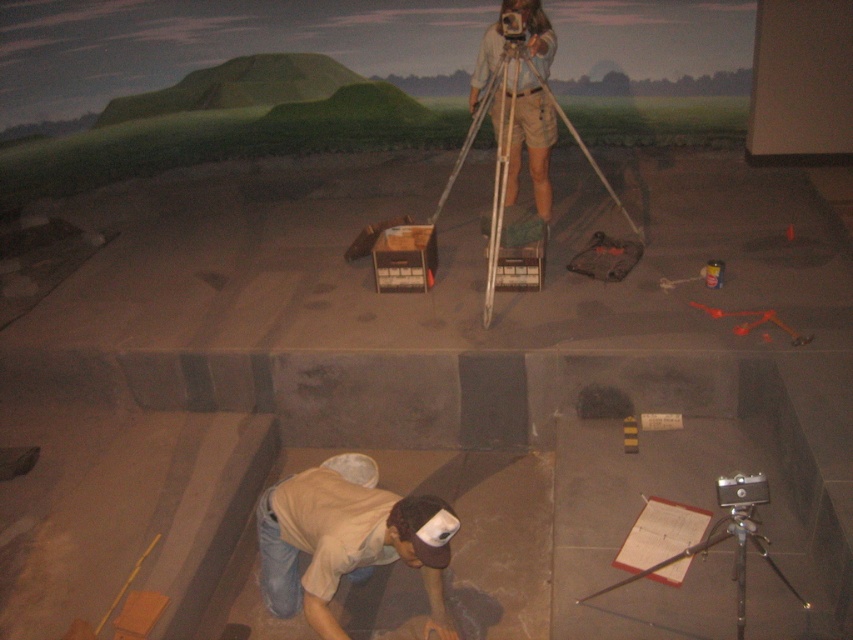
Which is more to the right, brown cotton shirt at lower center or silver metallic tripod at lower right?

Positioned to the right is silver metallic tripod at lower right.

Can you confirm if brown cotton shirt at lower center is positioned above silver metallic tripod at lower right?

Incorrect, brown cotton shirt at lower center is not positioned above silver metallic tripod at lower right.

Locate an element on the screen. brown cotton shirt at lower center is located at coordinates (341, 545).

Is brown cotton shirt at lower center bigger than silver metallic tripod at upper center?

Indeed, brown cotton shirt at lower center has a larger size compared to silver metallic tripod at upper center.

In the scene shown: Who is positioned more to the left, brown cotton shirt at lower center or silver metallic tripod at upper center?

Positioned to the left is brown cotton shirt at lower center.

Which is in front, point (271, 509) or point (512, 12)?

Positioned in front is point (271, 509).

At what (x,y) coordinates should I click in order to perform the action: click on brown cotton shirt at lower center. Please return your answer as a coordinate pair (x, y). This screenshot has width=853, height=640. Looking at the image, I should click on (341, 545).

Is matte khaki shorts at center to the left of silver metallic camera at lower right from the viewer's perspective?

Yes, matte khaki shorts at center is to the left of silver metallic camera at lower right.

Is point (514, 186) closer to viewer compared to point (724, 500)?

That is False.

Is point (547, 152) less distant than point (735, 500)?

That is False.

Locate an element on the screen. This screenshot has width=853, height=640. matte khaki shorts at center is located at coordinates tap(531, 141).